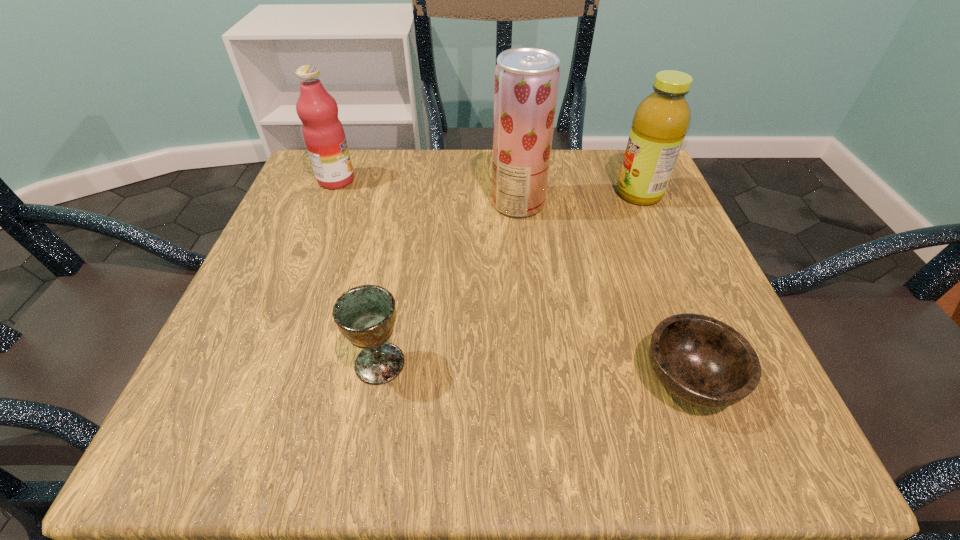
Where is `the tallest object`? The image size is (960, 540). the tallest object is located at coordinates click(526, 85).

Find the location of a particular element. This screenshot has width=960, height=540. the second fruit juice from right to left is located at coordinates (526, 85).

Find the location of a particular element. The width and height of the screenshot is (960, 540). the rightmost fruit juice is located at coordinates (661, 121).

Find the location of `the leftmost fruit juice`. the leftmost fruit juice is located at coordinates (324, 136).

Identify the location of chalice. Image resolution: width=960 pixels, height=540 pixels. (365, 315).

Identify the location of the second shortest object. (365, 315).

Locate an element on the screen. This screenshot has height=540, width=960. bowl is located at coordinates (703, 361).

Find the location of a particular element. vacant space located 0.070m on the back of the third object from left to right is located at coordinates (515, 170).

I want to click on vacant space located on the front label of the rightmost fruit juice, so click(x=535, y=194).

What are the coordinates of `free point located on the front label of the rightmost fruit juice` in the screenshot? It's located at (535, 194).